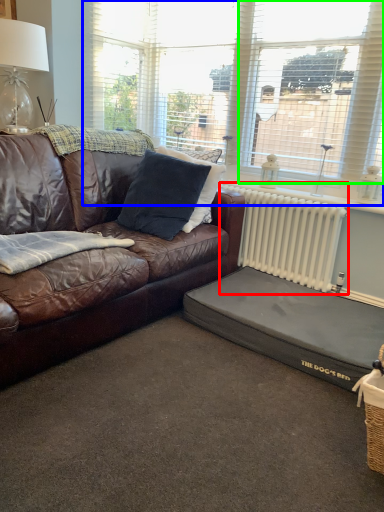
Question: Estimate the real-world distances between objects in this image. Which object is farther from radiator (highlighted by a red box), window (highlighted by a blue box) or window (highlighted by a green box)?

Choices:
 (A) window
 (B) window

Answer: (A)